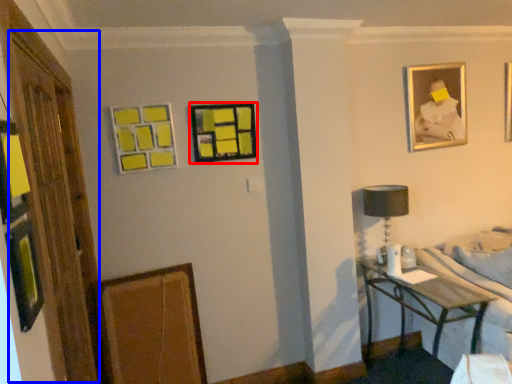
Question: Which of the following is the closest to the observer, picture frame (highlighted by a red box) or glass door (highlighted by a blue box)?

Choices:
 (A) picture frame
 (B) glass door

Answer: (B)